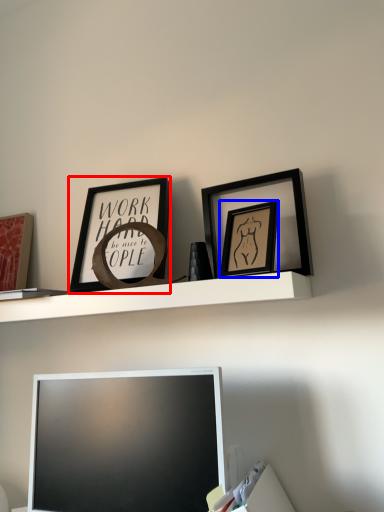
Question: Which point is closer to the camera, picture frame (highlighted by a red box) or picture frame (highlighted by a blue box)?

Choices:
 (A) picture frame
 (B) picture frame

Answer: (B)